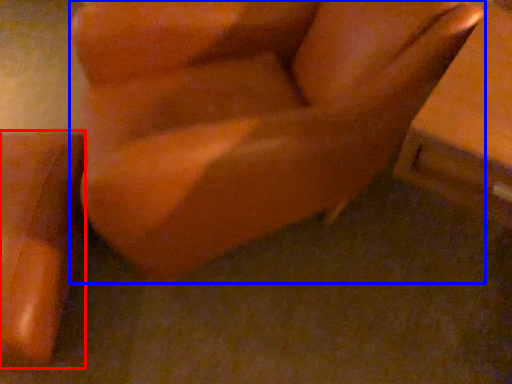
Question: Which object is closer to the camera taking this photo, furniture (highlighted by a red box) or furniture (highlighted by a blue box)?

Choices:
 (A) furniture
 (B) furniture

Answer: (B)